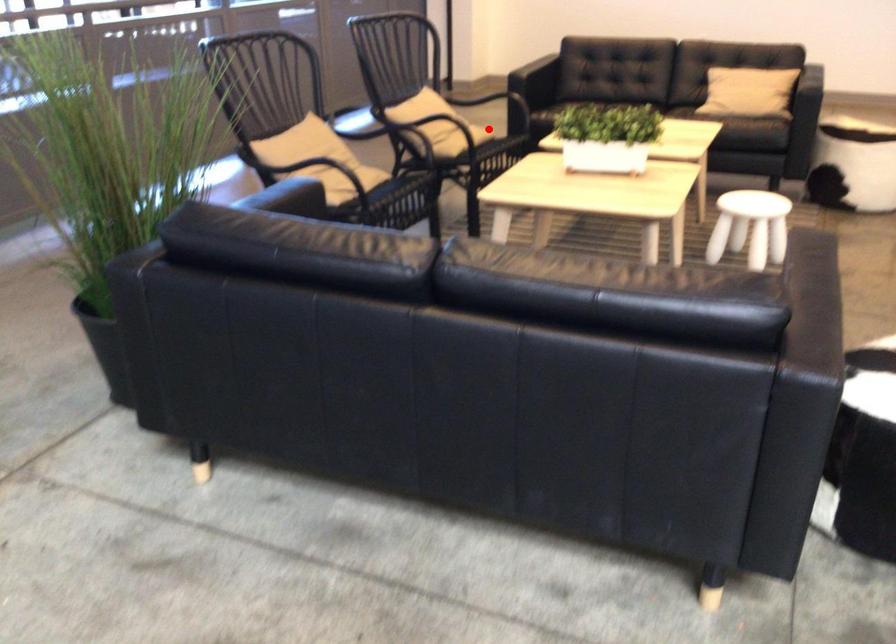
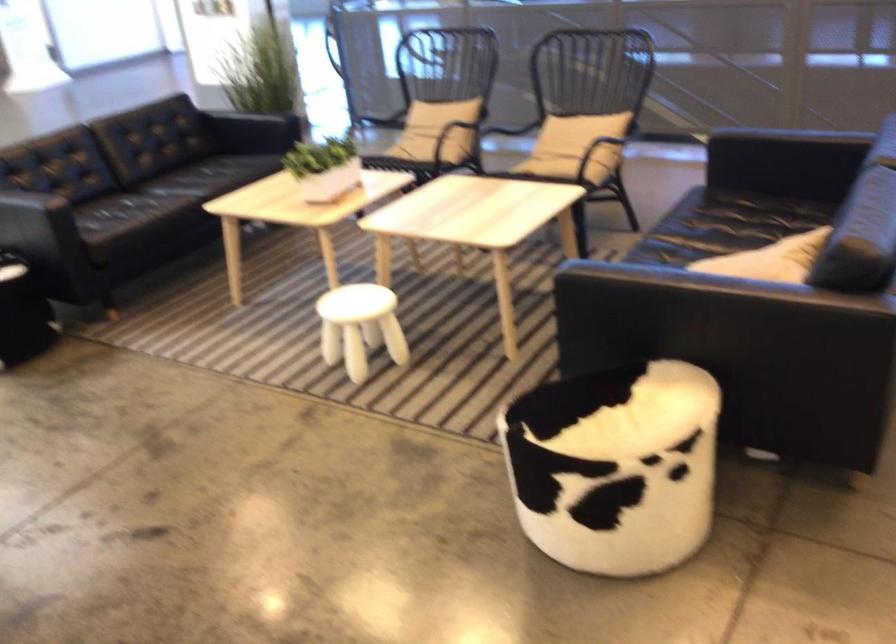
Find the pixel in the second image that matches the highlighted location in the first image.

(552, 160)